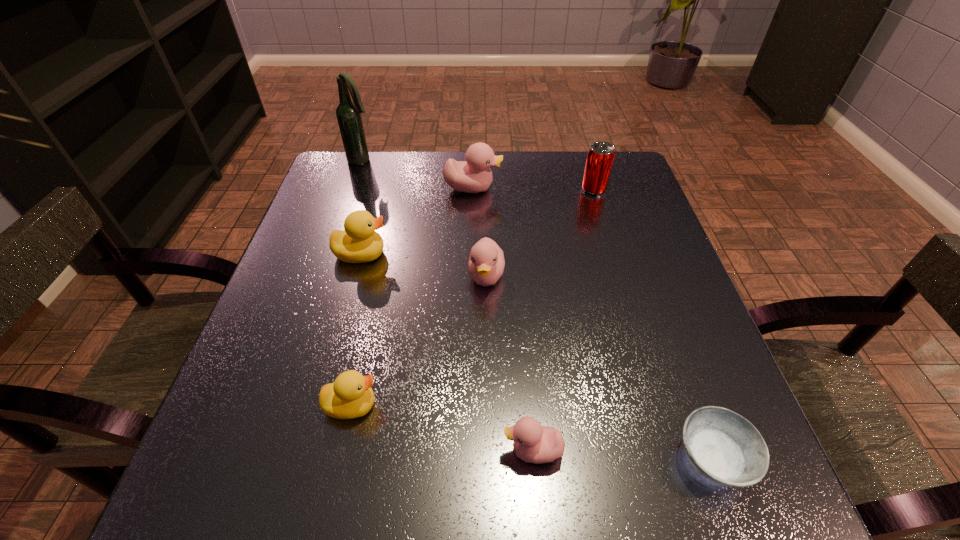
Locate an element on the screen. dark beer bottle is located at coordinates (348, 113).

In order to click on the tallest object in this screenshot , I will do `click(348, 113)`.

This screenshot has width=960, height=540. Identify the location of the biggest pink duckling. (474, 175).

This screenshot has height=540, width=960. I want to click on the farthest pink duckling, so click(x=474, y=175).

At what (x,y) coordinates should I click in order to perform the action: click on soda can. Please return your answer as a coordinate pair (x, y). The width and height of the screenshot is (960, 540). Looking at the image, I should click on (600, 157).

Identify the location of the farther yellow duckling. This screenshot has height=540, width=960. (359, 243).

Find the location of a particular element. The image size is (960, 540). the second biggest pink duckling is located at coordinates (486, 263).

I want to click on the fourth farthest duckling, so click(x=350, y=396).

Find the location of a particular element. The width and height of the screenshot is (960, 540). the smaller yellow duckling is located at coordinates (350, 396).

Where is `the nearest pink duckling`? This screenshot has width=960, height=540. the nearest pink duckling is located at coordinates click(533, 443).